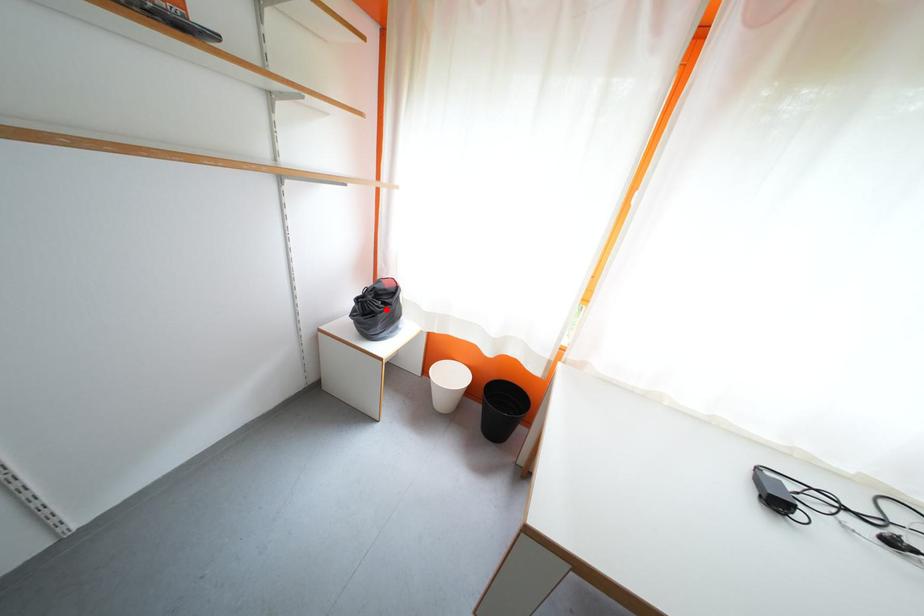
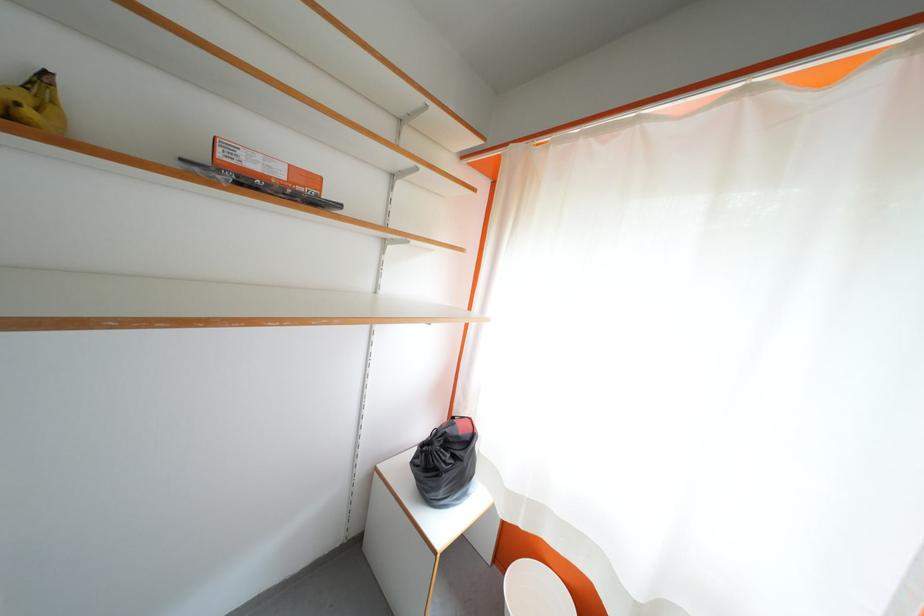
Where in the second image is the point corresponding to the highlighted location from the first image?

(455, 460)